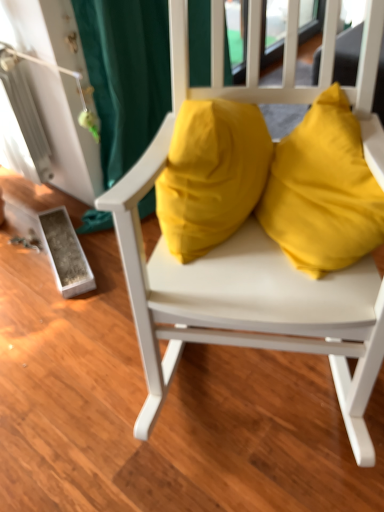
Locate an element on the screen. The height and width of the screenshot is (512, 384). yellow fabric pillow at center is located at coordinates (211, 174).

Describe the element at coordinates (211, 174) in the screenshot. I see `yellow fabric pillow at center` at that location.

What do you see at coordinates (245, 258) in the screenshot?
I see `matte yellow cushions at center` at bounding box center [245, 258].

Locate an element on the screen. This screenshot has width=384, height=512. matte yellow cushions at center is located at coordinates (245, 258).

In order to face matte yellow cushions at center, should I rotate leftwards or rightwards?

Rotate your view right by about 11.111°.

Locate an element on the screen. The image size is (384, 512). yellow fabric pillow at center is located at coordinates (211, 174).

Considering the relative positions of matte yellow cushions at center and yellow fabric pillow at center in the image provided, is matte yellow cushions at center to the left of yellow fabric pillow at center from the viewer's perspective?

In fact, matte yellow cushions at center is to the right of yellow fabric pillow at center.

Is the position of matte yellow cushions at center less distant than that of yellow fabric pillow at center?

That is True.

Between point (191, 310) and point (223, 214), which one is positioned behind?

The point (223, 214) is farther.

From the image's perspective, is matte yellow cushions at center above yellow fabric pillow at center?

Incorrect, from the image's perspective, matte yellow cushions at center is lower than yellow fabric pillow at center.

From a real-world perspective, relative to yellow fabric pillow at center, is matte yellow cushions at center vertically above or below?

From a real-world perspective, matte yellow cushions at center is physically below yellow fabric pillow at center.

Does matte yellow cushions at center have a lesser width compared to yellow fabric pillow at center?

No, matte yellow cushions at center is not thinner than yellow fabric pillow at center.

Considering the sizes of objects matte yellow cushions at center and yellow fabric pillow at center in the image provided, who is shorter, matte yellow cushions at center or yellow fabric pillow at center?

Standing shorter between the two is yellow fabric pillow at center.

Between matte yellow cushions at center and yellow fabric pillow at center, which one has smaller size?

yellow fabric pillow at center.

Is yellow fabric pillow at center surrounded by matte yellow cushions at center?

Absolutely, yellow fabric pillow at center is inside matte yellow cushions at center.

Is matte yellow cushions at center not near yellow fabric pillow at center?

No.

Is matte yellow cushions at center aimed at yellow fabric pillow at center?

Yes, matte yellow cushions at center is facing yellow fabric pillow at center.

How many degrees apart are the facing directions of matte yellow cushions at center and yellow fabric pillow at center?

The angular difference between matte yellow cushions at center and yellow fabric pillow at center is 64.8 degrees.

Measure the distance from matte yellow cushions at center to yellow fabric pillow at center.

14.97 centimeters.

This screenshot has width=384, height=512. Identify the location of chair below the yellow fabric pillow at center (from a real-world perspective). (245, 258).

Which object is positioned more to the left, yellow fabric pillow at center or matte yellow cushions at center?

yellow fabric pillow at center.

In the image, is yellow fabric pillow at center positioned in front of or behind matte yellow cushions at center?

yellow fabric pillow at center is positioned farther from the viewer than matte yellow cushions at center.

Considering the positions of points (260, 170) and (380, 0), is point (260, 170) closer to camera compared to point (380, 0)?

No, (260, 170) is further to viewer.

Based on the photo, from the image's perspective, is yellow fabric pillow at center above or below matte yellow cushions at center?

Clearly, from the image's perspective, yellow fabric pillow at center is above matte yellow cushions at center.

From a real-world perspective, is yellow fabric pillow at center physically below matte yellow cushions at center?

Incorrect, from a real-world perspective, yellow fabric pillow at center is higher than matte yellow cushions at center.

Is yellow fabric pillow at center wider than matte yellow cushions at center?

In fact, yellow fabric pillow at center might be narrower than matte yellow cushions at center.

Does yellow fabric pillow at center have a lesser height compared to matte yellow cushions at center?

Correct, yellow fabric pillow at center is not as tall as matte yellow cushions at center.

Does yellow fabric pillow at center have a smaller size compared to matte yellow cushions at center?

Yes.

Is yellow fabric pillow at center not inside matte yellow cushions at center?

That's incorrect, yellow fabric pillow at center is not completely outside matte yellow cushions at center.

Is yellow fabric pillow at center in contact with matte yellow cushions at center?

yellow fabric pillow at center and matte yellow cushions at center are not in contact.

Is yellow fabric pillow at center facing towards matte yellow cushions at center?

Yes, yellow fabric pillow at center faces towards matte yellow cushions at center.

Identify the location of pillow behind the matte yellow cushions at center. This screenshot has width=384, height=512. (211, 174).

The image size is (384, 512). What are the coordinates of `pillow above the matte yellow cushions at center (from a real-world perspective)` in the screenshot? It's located at (211, 174).

This screenshot has height=512, width=384. Find the location of `pillow behind the matte yellow cushions at center`. pillow behind the matte yellow cushions at center is located at coordinates (211, 174).